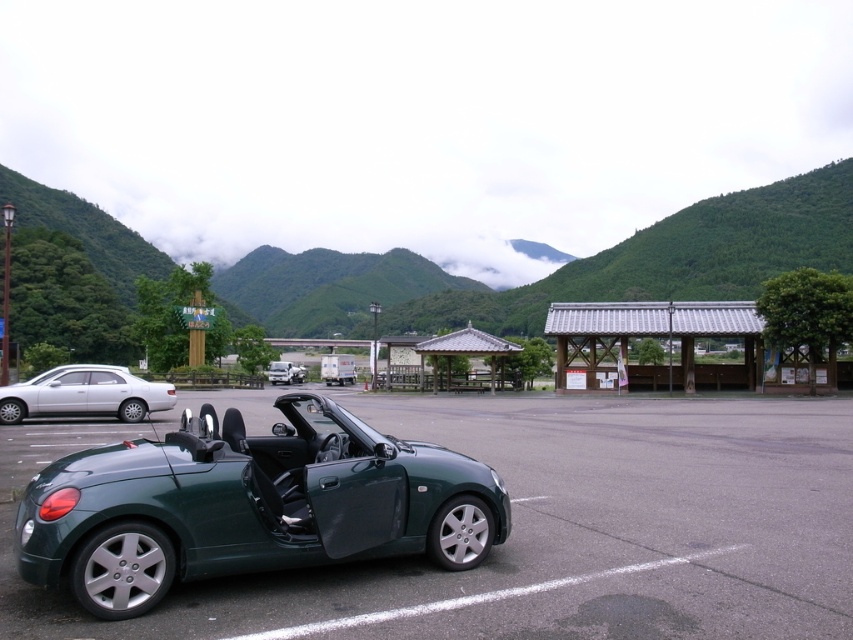
You are standing at the origin point in the parking area. The green matte sports car at center is at coordinates 0.789 on the x and 0.293 on the y. If you want to walk directly to the car, which direction should you move in terms of x and y coordinates?

To reach the green matte sports car at center located at coordinates x 0.789 and y 0.293, you should move in the positive x and positive y directions since both coordinates are greater than zero.

Looking at this image, you are standing at the origin point in the parking area and want to reach the green matte sports car at center. According to the coordinates provided, in which direction should you move to find the car?

The green matte sports car at center is located at point 0.789 on the x axis and 0.293 on the y axis. Since you are at the origin, you should move towards the positive x and positive y directions to reach it.

Consider the image. You are a pedestrian standing at the entrance of the parking lot. You see the green matte sports car at center and the metallic silver truck at center. Which vehicle is closer to you?

The green matte sports car at center is closer to you because it is positioned in front of the metallic silver truck at center.